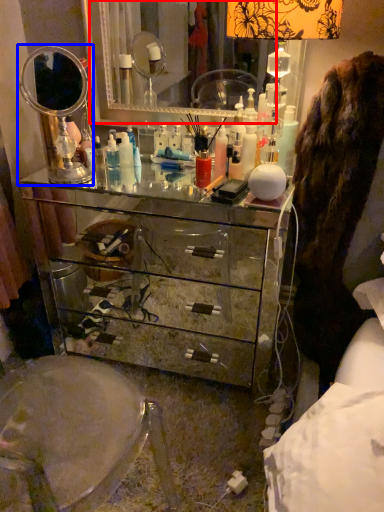
Question: Among these objects, which one is farthest to the camera, mirror (highlighted by a red box) or mirror (highlighted by a blue box)?

Choices:
 (A) mirror
 (B) mirror

Answer: (A)